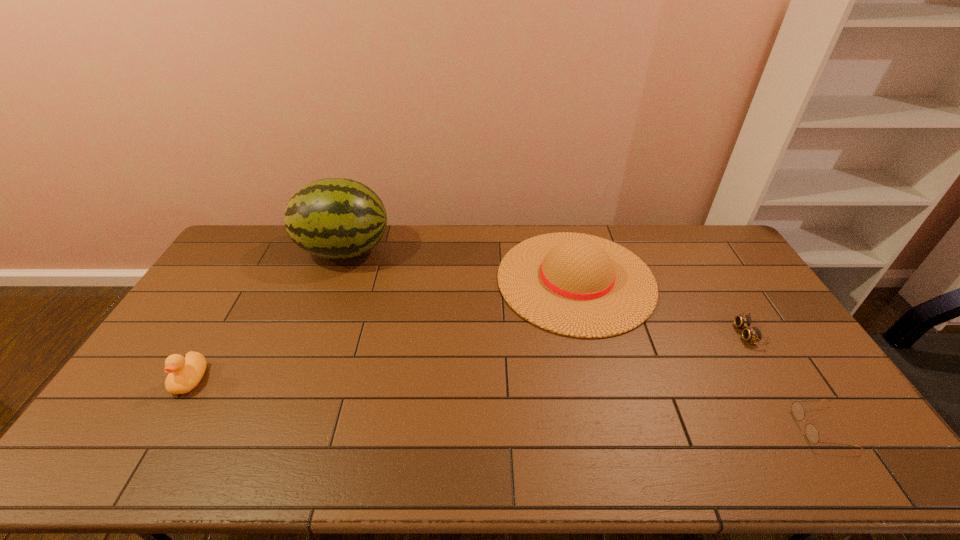
This screenshot has width=960, height=540. Find the location of `vacant area that lies between the spectacles and the goggles`. vacant area that lies between the spectacles and the goggles is located at coordinates (783, 380).

Locate an element on the screen. Image resolution: width=960 pixels, height=540 pixels. free space that is in between the goggles and the nearest object is located at coordinates (783, 380).

The height and width of the screenshot is (540, 960). Identify the location of vacant space that is in between the second nearest object and the tallest object. (267, 315).

Find the location of a particular element. vacant space that's between the bonnet and the duck is located at coordinates (383, 329).

I want to click on vacant space that's between the fourth object from right to left and the third object from left to right, so click(460, 265).

Where is `vacant space that is in between the third shortest object and the fourth object from right to left`? This screenshot has height=540, width=960. vacant space that is in between the third shortest object and the fourth object from right to left is located at coordinates (267, 315).

Image resolution: width=960 pixels, height=540 pixels. In order to click on free spot between the nearest object and the leftmost object in this screenshot , I will do `click(505, 403)`.

I want to click on vacant region between the spectacles and the goggles, so click(783, 380).

The height and width of the screenshot is (540, 960). Identify the location of free area in between the nearest object and the third object from right to left. click(x=698, y=354).

Locate an element on the screen. The width and height of the screenshot is (960, 540). free space between the duck and the spectacles is located at coordinates (505, 403).